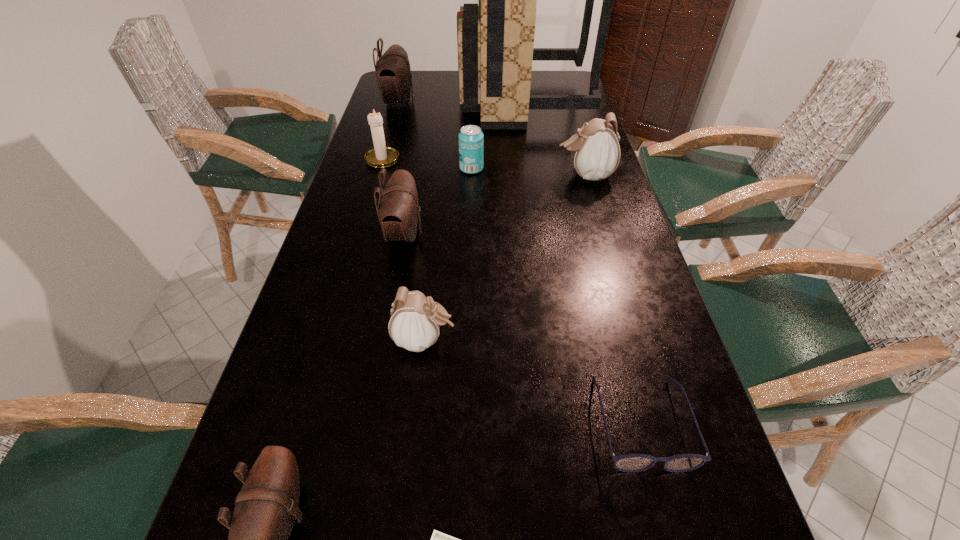
Where is `backpack`? This screenshot has width=960, height=540. backpack is located at coordinates (495, 40).

The height and width of the screenshot is (540, 960). I want to click on the farthest brown pouch, so click(x=393, y=73).

Locate an element on the screen. The image size is (960, 540). the farthest pouch is located at coordinates (393, 73).

Locate an element on the screen. The image size is (960, 540). the fourth nearest pouch is located at coordinates (595, 149).

You are a GUI agent. You are given a task and a screenshot of the screen. Output one action in this format:
    pyautogui.click(x=<x>, y=<y>)
    Task: Click on the right white pouch
    
    Given the screenshot: What is the action you would take?
    pyautogui.click(x=595, y=149)

Find the location of `the second smallest brown pouch`. the second smallest brown pouch is located at coordinates (398, 209).

Locate an element on the screen. the second farthest brown pouch is located at coordinates (398, 209).

Identify the location of candle holder. (380, 156).

This screenshot has width=960, height=540. In order to click on the second nearest pouch in this screenshot , I will do `click(415, 320)`.

The height and width of the screenshot is (540, 960). In order to click on the nearer white pouch in this screenshot , I will do `click(415, 320)`.